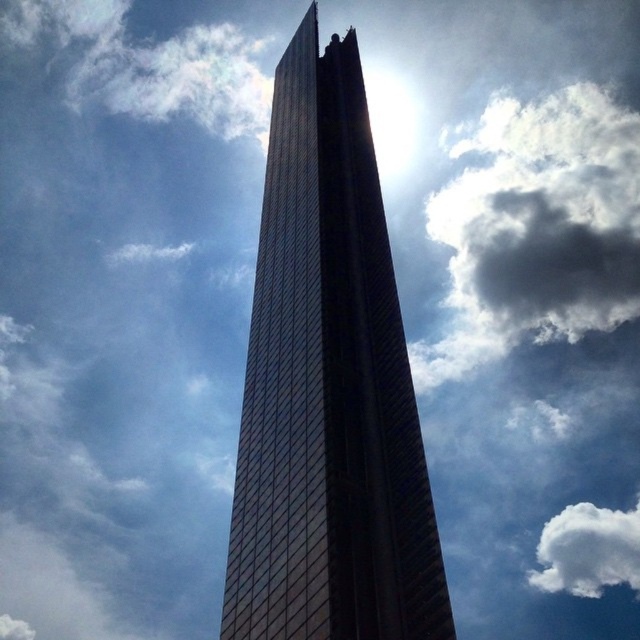
The image size is (640, 640). Identify the location of shiny glass tower at center. [x=328, y=388].

Does shiny glass tower at center appear on the left side of white fluffy cloud at upper right?

Correct, you'll find shiny glass tower at center to the left of white fluffy cloud at upper right.

Find the location of a particular element. This screenshot has height=640, width=640. shiny glass tower at center is located at coordinates (328, 388).